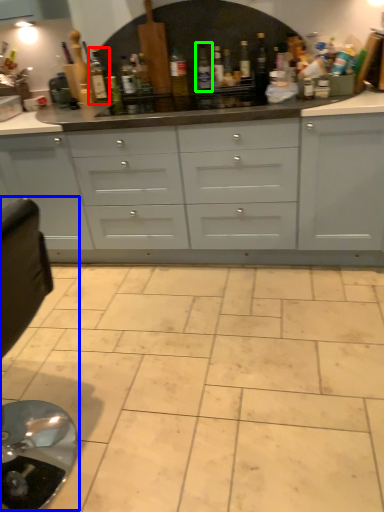
Question: Which is nearer to the bottle (highlighted by a red box)? swivel chair (highlighted by a blue box) or bottle (highlighted by a green box).

Choices:
 (A) swivel chair
 (B) bottle

Answer: (B)